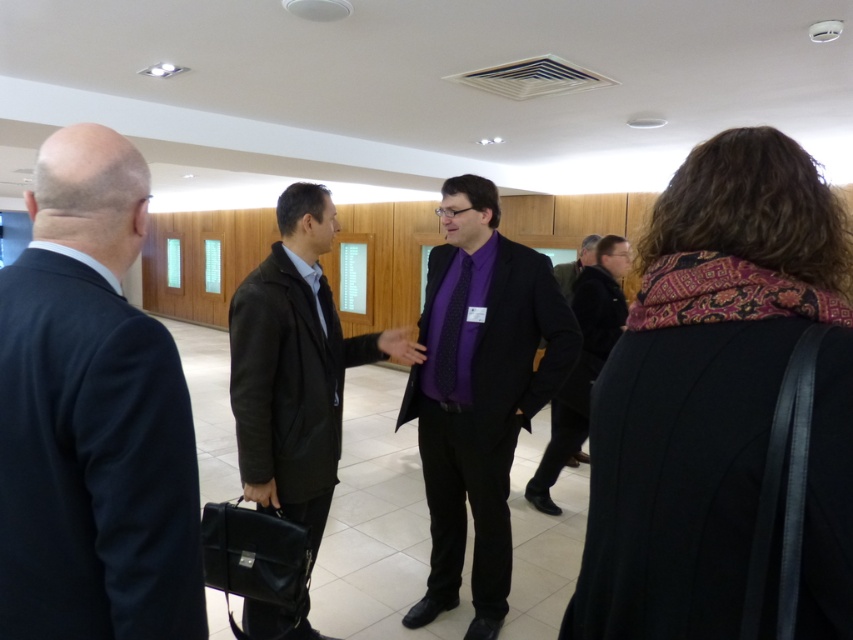
Does dark brown leather jacket at center appear on the left side of purple matte suit at center?

Yes, dark brown leather jacket at center is to the left of purple matte suit at center.

Between dark brown leather jacket at center and purple matte suit at center, which one is positioned higher?

purple matte suit at center

Between point (258, 432) and point (541, 490), which one is positioned behind?

Point (541, 490)

Image resolution: width=853 pixels, height=640 pixels. Find the location of `dark brown leather jacket at center`. dark brown leather jacket at center is located at coordinates (296, 365).

Is point (35, 604) closer to viewer compared to point (627, 262)?

Yes, it is in front of point (627, 262).

Who is shorter, dark blue suit at left or purple matte suit at center?

dark blue suit at left is shorter.

Does point (54, 381) lie in front of point (590, 364)?

Yes, it is in front of point (590, 364).

Find the location of a particular element. The width and height of the screenshot is (853, 640). dark blue suit at left is located at coordinates (91, 417).

This screenshot has width=853, height=640. Describe the element at coordinates (91, 417) in the screenshot. I see `dark blue suit at left` at that location.

Can you confirm if dark blue suit at left is taller than dark brown leather jacket at center?

No.

Where is `dark blue suit at left`? dark blue suit at left is located at coordinates (91, 417).